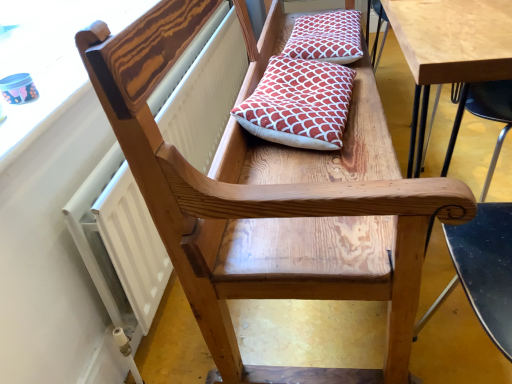
Question: From the image's perspective, does red patterned cushion at center, acting as the second pillow starting from the back, appear higher than white textured radiator at upper left?

Choices:
 (A) no
 (B) yes

Answer: (B)

Question: Can you confirm if red patterned cushion at center, arranged as the 1th pillow when viewed from the front, is smaller than white textured radiator at upper left?

Choices:
 (A) no
 (B) yes

Answer: (B)

Question: Is the depth of red patterned cushion at center, the first pillow positioned from the bottom, greater than that of white textured radiator at upper left?

Choices:
 (A) no
 (B) yes

Answer: (B)

Question: Can you see red patterned cushion at center, arranged as the 1th pillow when viewed from the front, touching white textured radiator at upper left?

Choices:
 (A) yes
 (B) no

Answer: (B)

Question: Is red patterned cushion at center, acting as the second pillow starting from the back, bigger than white textured radiator at upper left?

Choices:
 (A) no
 (B) yes

Answer: (A)

Question: Relative to wooden chair arm at upper left, is red patterned cushion at center, the first pillow positioned from the bottom, in front or behind?

Choices:
 (A) behind
 (B) front

Answer: (A)

Question: From the image's perspective, is red patterned cushion at center, the second pillow from the top, positioned above or below wooden chair arm at upper left?

Choices:
 (A) above
 (B) below

Answer: (B)

Question: Would you say red patterned cushion at center, the second pillow from the top, is inside or outside wooden chair arm at upper left?

Choices:
 (A) outside
 (B) inside

Answer: (A)

Question: In terms of width, does red patterned cushion at center, arranged as the 1th pillow when viewed from the front, look wider or thinner when compared to wooden chair arm at upper left?

Choices:
 (A) thin
 (B) wide

Answer: (B)

Question: In terms of width, does red patterned cushion at upper center, the second pillow viewed from the front, look wider or thinner when compared to white textured radiator at upper left?

Choices:
 (A) wide
 (B) thin

Answer: (A)

Question: From a real-world perspective, is red patterned cushion at upper center, the second pillow in the bottom-to-top sequence, positioned above or below white textured radiator at upper left?

Choices:
 (A) above
 (B) below

Answer: (A)

Question: Which is correct: red patterned cushion at upper center, the 1th pillow when ordered from back to front, is inside white textured radiator at upper left, or outside of it?

Choices:
 (A) outside
 (B) inside

Answer: (A)

Question: From their relative heights in the image, would you say red patterned cushion at upper center, the second pillow viewed from the front, is taller or shorter than white textured radiator at upper left?

Choices:
 (A) tall
 (B) short

Answer: (B)

Question: In the image, is wooden chair arm at upper left positioned in front of or behind white textured radiator at upper left?

Choices:
 (A) behind
 (B) front

Answer: (B)

Question: Is wooden chair arm at upper left to the left or to the right of white textured radiator at upper left in the image?

Choices:
 (A) right
 (B) left

Answer: (B)